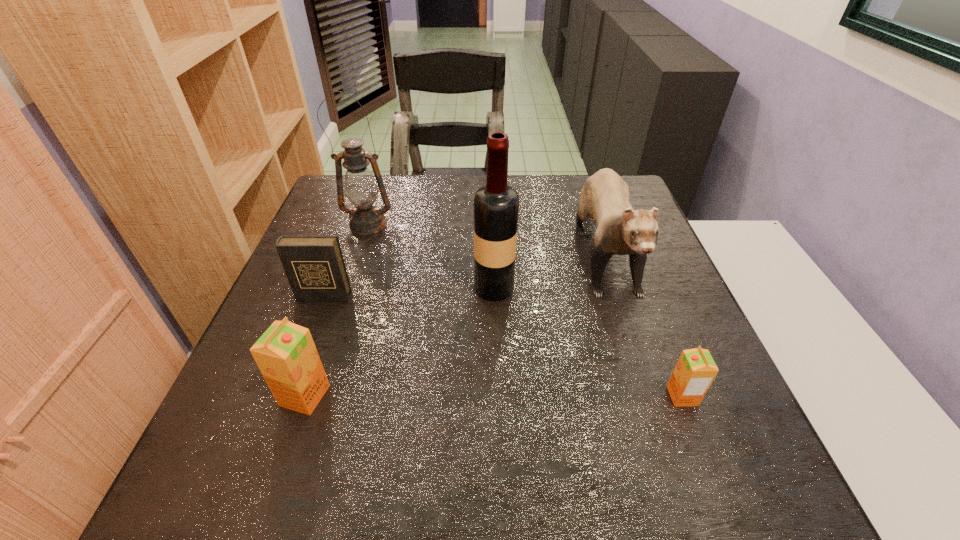
You are a GUI agent. You are given a task and a screenshot of the screen. Output one action in this format:
    pyautogui.click(x=<x>, y=<y>)
    Task: Click on the location for an additional orange_juice to make spacing equal
    Image resolution: width=960 pixels, height=540 pixels.
    Given the screenshot: What is the action you would take?
    pyautogui.click(x=493, y=396)